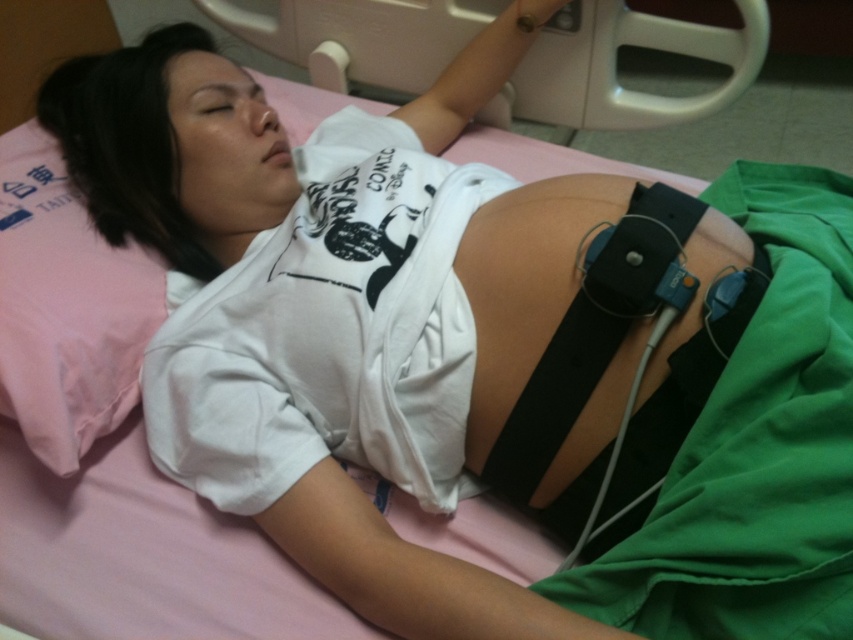
Does point (397, 58) lie behind point (15, 276)?

Yes, point (397, 58) is behind point (15, 276).

Between black rubber belt at upper center and pink fabric pillow at left, which one has less height?

With less height is black rubber belt at upper center.

Is point (555, 28) positioned behind point (125, 260)?

Yes, point (555, 28) is farther from viewer.

Where is `black rubber belt at upper center`? The height and width of the screenshot is (640, 853). black rubber belt at upper center is located at coordinates (614, 67).